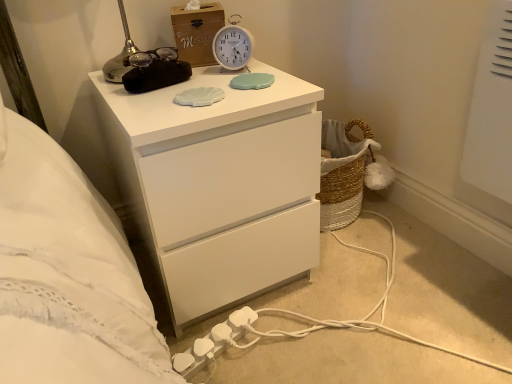
Find the location of a particular element. The width and height of the screenshot is (512, 384). free spot to the left of white plastic alarm clock at upper center is located at coordinates (184, 80).